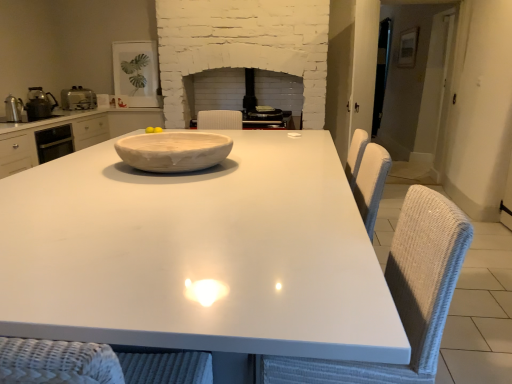
What do you see at coordinates (136, 72) in the screenshot?
I see `matte white picture frame at upper left, acting as the fourth appliance starting from the front` at bounding box center [136, 72].

What is the approximate width of metallic silver kettle at left, which is counted as the fourth appliance, starting from the back?

It is 4.88 inches.

What do you see at coordinates (198, 254) in the screenshot? The height and width of the screenshot is (384, 512). I see `white glossy table at center` at bounding box center [198, 254].

In order to click on metallic silver kettle at left, the second appliance positioned from the front in this screenshot , I will do `click(39, 104)`.

Describe the element at coordinates (173, 151) in the screenshot. I see `white matte bowl at center` at that location.

The image size is (512, 384). I want to click on satin silver toaster at left, placed as the third appliance when sorted from front to back, so click(x=78, y=98).

Considering the relative sizes of yellow matte/yellowish smooth lemon at center and white matte bowl at center in the image provided, is yellow matte/yellowish smooth lemon at center taller than white matte bowl at center?

No, yellow matte/yellowish smooth lemon at center is not taller than white matte bowl at center.

Between point (157, 127) and point (168, 166), which one is positioned behind?

Positioned behind is point (157, 127).

From a real-world perspective, who is located higher, yellow matte/yellowish smooth lemon at center or white matte bowl at center?

white matte bowl at center is physically above.

From the picture: Is white glossy table at center at the back of white matte bowl at center?

No, white matte bowl at center's orientation is not away from white glossy table at center.

Is white matte bowl at center next to white glossy table at center?

No, white matte bowl at center is not next to white glossy table at center.

Image resolution: width=512 pixels, height=384 pixels. I want to click on bowl lying above the white glossy table at center (from the image's perspective), so click(173, 151).

Based on the photo, in the image, is satin silver toaster at left, placed as the third appliance when sorted from front to back, positioned in front of or behind white glossy table at center?

satin silver toaster at left, placed as the third appliance when sorted from front to back, is behind white glossy table at center.

Which of these two, satin silver toaster at left, which is counted as the 2th appliance, starting from the back, or white glossy table at center, stands shorter?

Standing shorter between the two is satin silver toaster at left, which is counted as the 2th appliance, starting from the back.

From a real-world perspective, between satin silver toaster at left, placed as the third appliance when sorted from front to back, and white glossy table at center, who is vertically higher?

In real-world perspective, satin silver toaster at left, placed as the third appliance when sorted from front to back, is above.

Considering the positions of objects metallic silver kettle at left, the second appliance positioned from the front, and white matte bowl at center in the image provided, who is in front, metallic silver kettle at left, the second appliance positioned from the front, or white matte bowl at center?

white matte bowl at center is closer to the camera.

From a real-world perspective, is metallic silver kettle at left, the 3th appliance when ordered from back to front, beneath white matte bowl at center?

No.

What's the angular difference between metallic silver kettle at left, the second appliance positioned from the front, and white matte bowl at center's facing directions?

2.1 degrees separate the facing orientations of metallic silver kettle at left, the second appliance positioned from the front, and white matte bowl at center.

I want to click on the 2nd appliance behind the white matte bowl at center, so click(39, 104).

At what (x,y) coordinates should I click in order to perform the action: click on bowl directly beneath the metallic silver kettle at left, the 3th appliance when ordered from back to front (from a real-world perspective). Please return your answer as a coordinate pair (x, y). Looking at the image, I should click on (173, 151).

Considering the relative positions of white matte bowl at center and metallic silver kettle at left, the 3th appliance when ordered from back to front, in the image provided, is white matte bowl at center to the left or to the right of metallic silver kettle at left, the 3th appliance when ordered from back to front,?

white matte bowl at center is to the right of metallic silver kettle at left, the 3th appliance when ordered from back to front.

In the scene shown: Is white matte bowl at center behind metallic silver kettle at left, the 3th appliance when ordered from back to front?

No, it is in front of metallic silver kettle at left, the 3th appliance when ordered from back to front.

Considering the relative sizes of white matte bowl at center and metallic silver kettle at left, the 3th appliance when ordered from back to front, in the image provided, is white matte bowl at center thinner than metallic silver kettle at left, the 3th appliance when ordered from back to front,?

No, white matte bowl at center is not thinner than metallic silver kettle at left, the 3th appliance when ordered from back to front.

From the image's perspective, between yellow matte/yellowish smooth lemon at center and white glossy table at center, who is located below?

white glossy table at center, from the image's perspective.

Does point (155, 130) come farther from viewer compared to point (32, 289)?

Yes, it is.

Where is `table below the yellow matte/yellowish smooth lemon at center (from a real-world perspective)`? table below the yellow matte/yellowish smooth lemon at center (from a real-world perspective) is located at coordinates (198, 254).

Is yellow matte/yellowish smooth lemon at center far away from white glossy table at center?

yellow matte/yellowish smooth lemon at center is positioned a significant distance from white glossy table at center.

From a real-world perspective, which is physically below, metallic silver kettle at left, the first appliance from the front, or matte white picture frame at upper left, acting as the fourth appliance starting from the front?

From a 3D spatial view, metallic silver kettle at left, the first appliance from the front, is below.

Does metallic silver kettle at left, which is counted as the fourth appliance, starting from the back, have a smaller size compared to matte white picture frame at upper left, acting as the fourth appliance starting from the front?

Yes.

Which object is thinner, metallic silver kettle at left, the first appliance from the front, or matte white picture frame at upper left, acting as the fourth appliance starting from the front?

metallic silver kettle at left, the first appliance from the front, is thinner.

The width and height of the screenshot is (512, 384). In the image, there is a yellow matte/yellowish smooth lemon at center. What are the coordinates of `bowl below it (from the image's perspective)` in the screenshot? It's located at (173, 151).

Locate an element on the screen. bowl above the white glossy table at center (from a real-world perspective) is located at coordinates (173, 151).

Looking at the image, which one is located further to metallic silver kettle at left, the first appliance from the front, satin silver toaster at left, placed as the third appliance when sorted from front to back, or matte white picture frame at upper left, acting as the fourth appliance starting from the front?

Among the two, matte white picture frame at upper left, acting as the fourth appliance starting from the front, is located further to metallic silver kettle at left, the first appliance from the front.

From the image, which object appears to be nearer to metallic silver kettle at left, the first appliance from the front, white matte bowl at center or white wicker swivel chair at right?

white matte bowl at center is closer to metallic silver kettle at left, the first appliance from the front.

Looking at this image, considering their positions, is white wicker swivel chair at right positioned closer to matte white picture frame at upper left, which is counted as the 1th appliance, starting from the back, than metallic silver kettle at left, which is counted as the fourth appliance, starting from the back?

The object closer to matte white picture frame at upper left, which is counted as the 1th appliance, starting from the back, is metallic silver kettle at left, which is counted as the fourth appliance, starting from the back.

Which object lies further to the anchor point white matte bowl at center, white wicker swivel chair at right or metallic silver kettle at left, the second appliance positioned from the front?

metallic silver kettle at left, the second appliance positioned from the front, is further to white matte bowl at center.

When comparing their distances from metallic silver kettle at left, the second appliance positioned from the front, does white glossy table at center or metallic silver kettle at left, the first appliance from the front, seem further?

Among the two, white glossy table at center is located further to metallic silver kettle at left, the second appliance positioned from the front.

From the image, which object appears to be nearer to satin silver toaster at left, placed as the third appliance when sorted from front to back, metallic silver kettle at left, the 3th appliance when ordered from back to front, or white wicker swivel chair at right?

metallic silver kettle at left, the 3th appliance when ordered from back to front, lies closer to satin silver toaster at left, placed as the third appliance when sorted from front to back, than the other object.

Looking at this image, which object lies further to the anchor point metallic silver kettle at left, the first appliance from the front, metallic silver kettle at left, the 3th appliance when ordered from back to front, or matte white picture frame at upper left, which is counted as the 1th appliance, starting from the back?

matte white picture frame at upper left, which is counted as the 1th appliance, starting from the back, is further to metallic silver kettle at left, the first appliance from the front.

Based on their spatial positions, is metallic silver kettle at left, the second appliance positioned from the front, or white wicker swivel chair at right further from matte white picture frame at upper left, which is counted as the 1th appliance, starting from the back?

white wicker swivel chair at right.

Locate an element on the screen. This screenshot has width=512, height=384. swivel chair between white glossy table at center and matte white picture frame at upper left, which is counted as the 1th appliance, starting from the back, from front to back is located at coordinates (402, 296).

Locate an element on the screen. appliance between white wicker swivel chair at right and metallic silver kettle at left, the second appliance positioned from the front, from front to back is located at coordinates [13, 109].

Find the location of `bowl located between white wicker swivel chair at right and satin silver toaster at left, placed as the third appliance when sorted from front to back, in the depth direction`. bowl located between white wicker swivel chair at right and satin silver toaster at left, placed as the third appliance when sorted from front to back, in the depth direction is located at coordinates (173, 151).

Where is `appliance positioned between metallic silver kettle at left, which is counted as the fourth appliance, starting from the back, and satin silver toaster at left, which is counted as the 2th appliance, starting from the back, from near to far`? This screenshot has height=384, width=512. appliance positioned between metallic silver kettle at left, which is counted as the fourth appliance, starting from the back, and satin silver toaster at left, which is counted as the 2th appliance, starting from the back, from near to far is located at coordinates (39, 104).